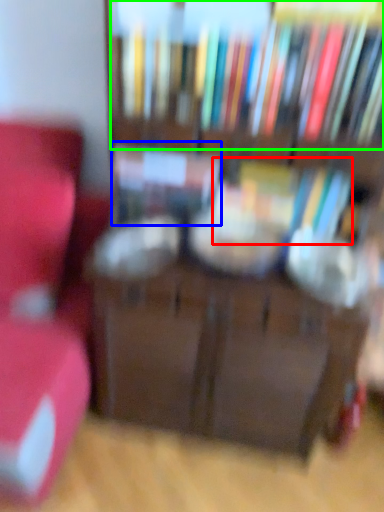
Question: Based on their relative distances, which object is nearer to book (highlighted by a red box)? Choose from book (highlighted by a blue box) and book (highlighted by a green box).

Choices:
 (A) book
 (B) book

Answer: (A)